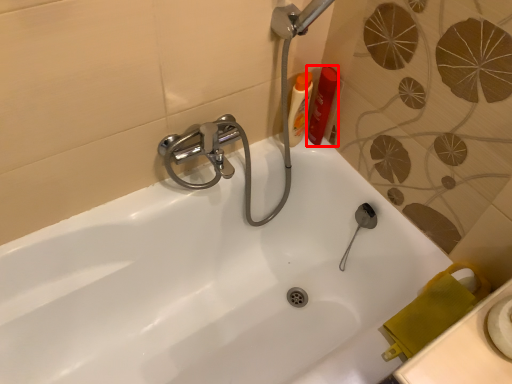
Question: Observing the image, what is the correct spatial positioning of toiletry (annotated by the red box) in reference to toiletry?

Choices:
 (A) right
 (B) left

Answer: (A)